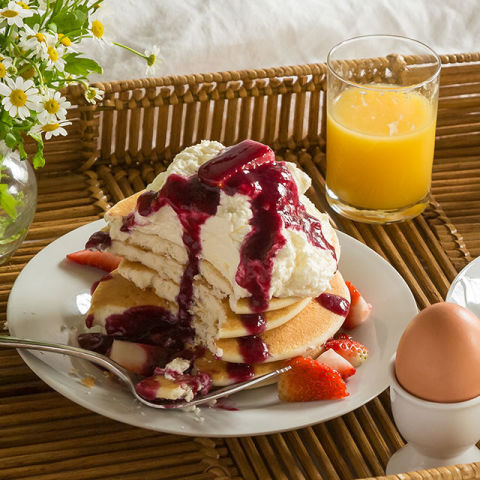
Image resolution: width=480 pixels, height=480 pixels. I want to click on plate, so click(x=303, y=412).